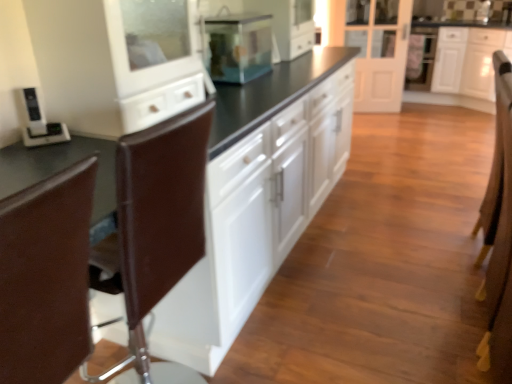
Question: Based on their sizes in the image, would you say brown leather armchair at right is bigger or smaller than white glossy cabinet at upper right, which is the first cabinetry in back-to-front order?

Choices:
 (A) small
 (B) big

Answer: (A)

Question: Considering the positions of brown leather armchair at right and white glossy cabinet at upper right, placed as the 1th cabinetry when sorted from right to left, in the image, is brown leather armchair at right wider or thinner than white glossy cabinet at upper right, placed as the 1th cabinetry when sorted from right to left,?

Choices:
 (A) wide
 (B) thin

Answer: (B)

Question: Estimate the real-world distances between objects in this image. Which object is farther from the black plastic phone at left?

Choices:
 (A) white glossy cabinets at center, which appears as the 1th cabinetry when viewed from the left
 (B) white glossy cabinet at upper right, which ranks as the 2th cabinetry in front-to-back order
 (C) brown leather armchair at right
 (D) white glossy door at center
 (E) brown leather swivel chair at left, which is the 2th swivel chair from front to back

Answer: (B)

Question: Considering the real-world distances, which object is closest to the white glossy cabinet at upper right, arranged as the 2th cabinetry when viewed from the left?

Choices:
 (A) white glossy cabinets at center, the 2th cabinetry from the back
 (B) black plastic phone at left
 (C) white glossy door at center
 (D) brown leather armchair at right
 (E) transparent glass fish tank at center

Answer: (C)